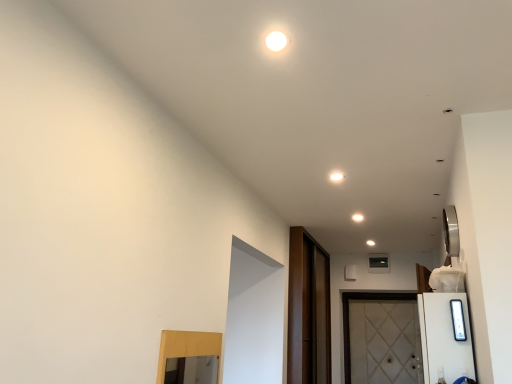
Question: From a real-world perspective, is white textured door at lower right on top of white glossy light at upper center?

Choices:
 (A) no
 (B) yes

Answer: (A)

Question: Is white textured door at lower right oriented away from white glossy light at upper center?

Choices:
 (A) yes
 (B) no

Answer: (B)

Question: Considering the relative sizes of white textured door at lower right and white glossy light at upper center in the image provided, is white textured door at lower right bigger than white glossy light at upper center?

Choices:
 (A) no
 (B) yes

Answer: (B)

Question: Does white textured door at lower right have a lesser width compared to white glossy light at upper center?

Choices:
 (A) yes
 (B) no

Answer: (B)

Question: Is white textured door at lower right positioned beyond the bounds of white glossy light at upper center?

Choices:
 (A) no
 (B) yes

Answer: (B)

Question: Considering the positions of point (323, 352) and point (420, 354), is point (323, 352) closer or farther from the camera than point (420, 354)?

Choices:
 (A) closer
 (B) farther

Answer: (A)

Question: Considering their positions, is dark brown wood screen door at center located in front of or behind white textured door at lower right?

Choices:
 (A) front
 (B) behind

Answer: (A)

Question: Is dark brown wood screen door at center wider or thinner than white textured door at lower right?

Choices:
 (A) thin
 (B) wide

Answer: (A)

Question: Based on their sizes in the image, would you say dark brown wood screen door at center is bigger or smaller than white textured door at lower right?

Choices:
 (A) big
 (B) small

Answer: (A)

Question: Is point (335, 175) closer or farther from the camera than point (317, 297)?

Choices:
 (A) closer
 (B) farther

Answer: (A)

Question: From their relative heights in the image, would you say white glossy light at upper center is taller or shorter than dark brown wood screen door at center?

Choices:
 (A) tall
 (B) short

Answer: (B)

Question: Is white glossy light at upper center in front of or behind dark brown wood screen door at center in the image?

Choices:
 (A) behind
 (B) front

Answer: (B)

Question: From a real-world perspective, is white glossy light at upper center positioned above or below dark brown wood screen door at center?

Choices:
 (A) below
 (B) above

Answer: (B)

Question: Is point (331, 177) positioned closer to the camera than point (391, 344)?

Choices:
 (A) closer
 (B) farther

Answer: (A)

Question: Considering the positions of white glossy light at upper center and white textured door at lower right in the image, is white glossy light at upper center taller or shorter than white textured door at lower right?

Choices:
 (A) tall
 (B) short

Answer: (B)